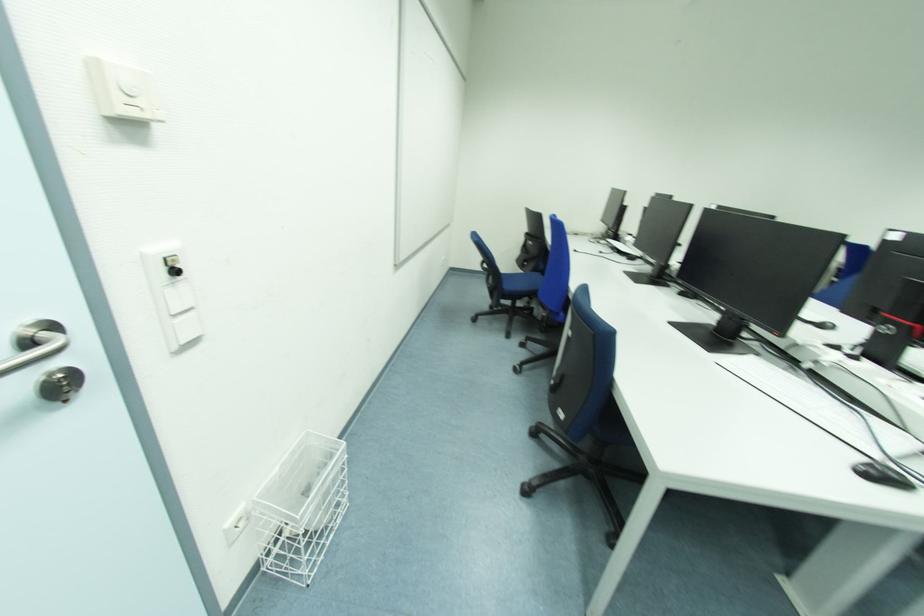
This screenshot has width=924, height=616. Identify the location of metal door handle. (34, 352).